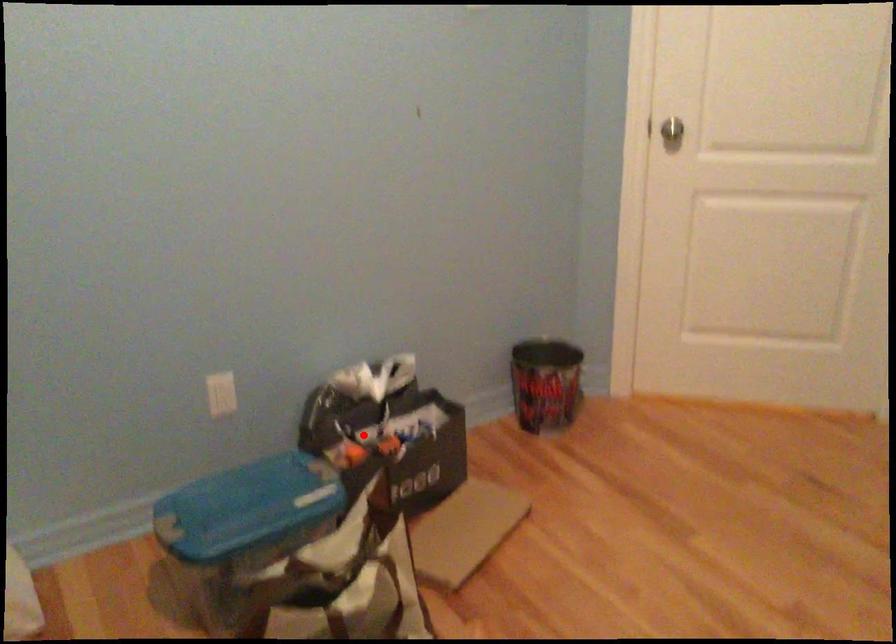
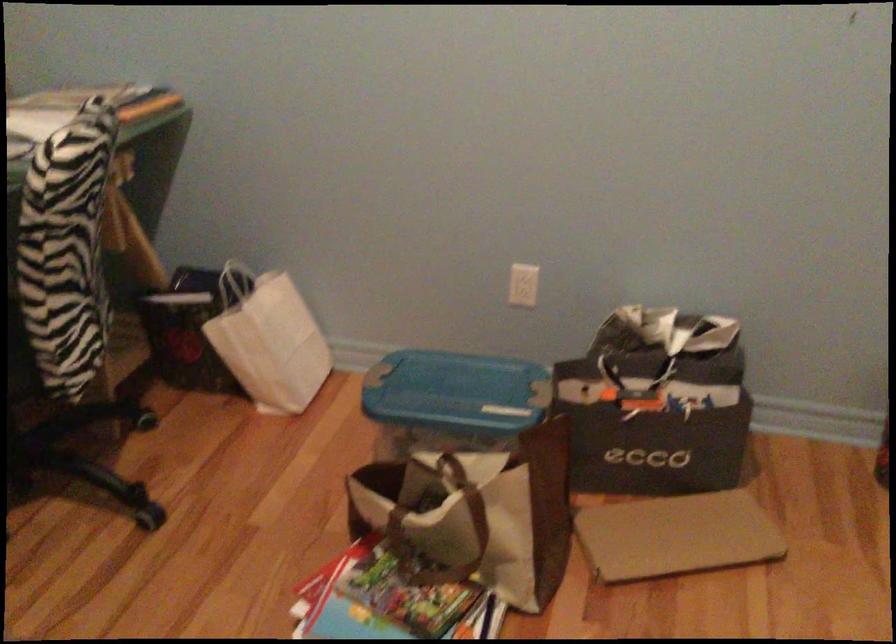
Question: I am providing you with two images of the same scene from different viewpoints. In image1, a red point is highlighted. Considering the same 3D point in image2, which of the following is correct?

Choices:
 (A) It is closer
 (B) It is farther

Answer: (A)